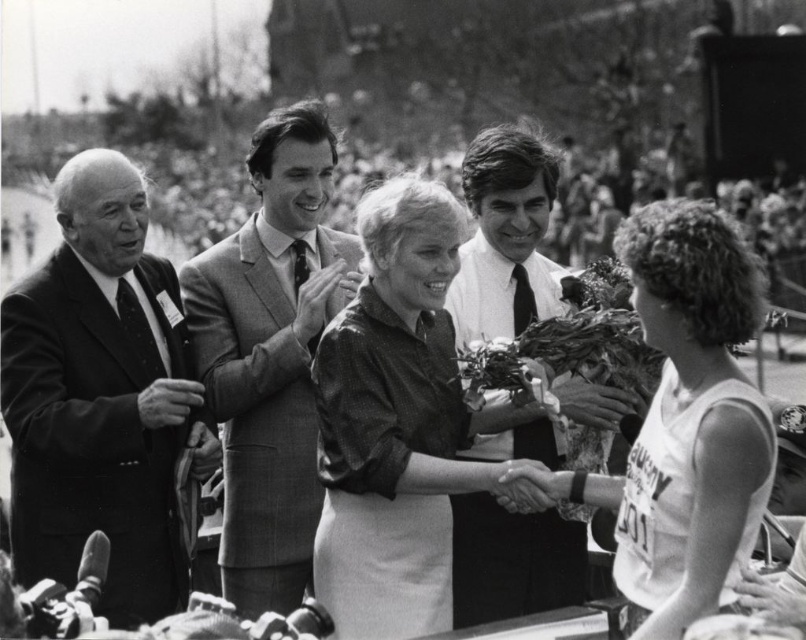
Between smooth suit at left and smooth suit at center, which one has less height?

smooth suit at left is shorter.

Is point (118, 332) farther from camera compared to point (347, 273)?

No, it is not.

At what (x,y) coordinates should I click in order to perform the action: click on smooth suit at left. Please return your answer as a coordinate pair (x, y). Image resolution: width=806 pixels, height=640 pixels. Looking at the image, I should click on (98, 396).

Can you confirm if shiny dark brown dress at center is taller than white shirt at center?

Incorrect, shiny dark brown dress at center's height is not larger of white shirt at center's.

Is shiny dark brown dress at center positioned before white shirt at center?

Yes, it is in front of white shirt at center.

What do you see at coordinates (393, 422) in the screenshot?
I see `shiny dark brown dress at center` at bounding box center [393, 422].

Where is `shiny dark brown dress at center`? shiny dark brown dress at center is located at coordinates (393, 422).

Is point (385, 340) positioned in front of point (721, 305)?

No, it is behind (721, 305).

Can you confirm if shiny dark brown dress at center is positioned below white jersey at center?

No, shiny dark brown dress at center is not below white jersey at center.

The width and height of the screenshot is (806, 640). Describe the element at coordinates (393, 422) in the screenshot. I see `shiny dark brown dress at center` at that location.

The width and height of the screenshot is (806, 640). I want to click on shiny dark brown dress at center, so click(x=393, y=422).